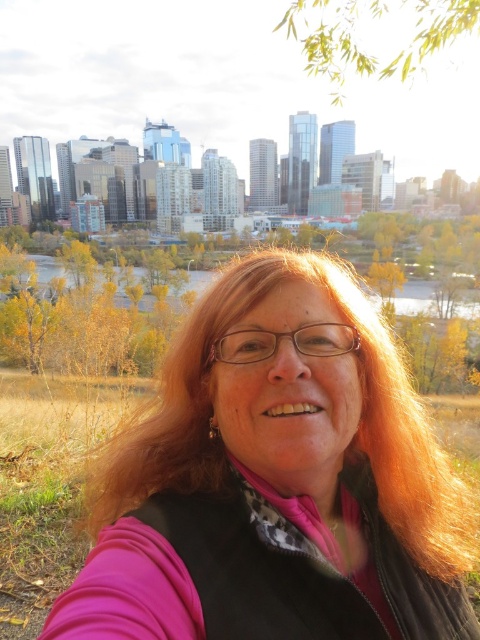
Does pink fabric at center appear under yellow-green leaves at upper center?

Indeed, pink fabric at center is positioned under yellow-green leaves at upper center.

Find the location of a particular element. pink fabric at center is located at coordinates (276, 481).

Locate an element on the screen. Image resolution: width=480 pixels, height=640 pixels. pink fabric at center is located at coordinates (276, 481).